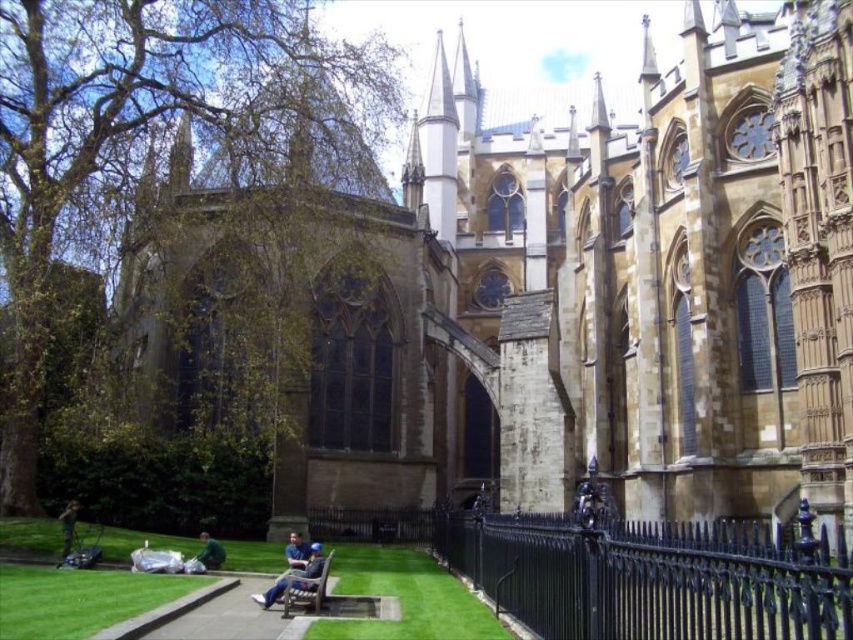
Which is behind, point (54, 608) or point (73, 531)?

The point (73, 531) is behind.

Which of these two, green grass at lower left or dark green jacket at lower left, stands shorter?

green grass at lower left

Between point (97, 582) and point (61, 516), which one is positioned in front?

Point (97, 582)

The height and width of the screenshot is (640, 853). Find the location of `green grass at lower left`. green grass at lower left is located at coordinates (79, 598).

Who is lower down, green fabric at lower center or dark green jacket at lower left?

green fabric at lower center is lower down.

Where is `green fabric at lower center`? green fabric at lower center is located at coordinates (210, 552).

Can you confirm if black wrought iron fence at lower right is smaller than blue denim jacket at lower center?

No.

Is black wrought iron fence at lower right to the right of blue denim jacket at lower center from the viewer's perspective?

Indeed, black wrought iron fence at lower right is positioned on the right side of blue denim jacket at lower center.

Find the location of `black wrought iron fence at lower right`. black wrought iron fence at lower right is located at coordinates (650, 577).

I want to click on black wrought iron fence at lower right, so click(x=650, y=577).